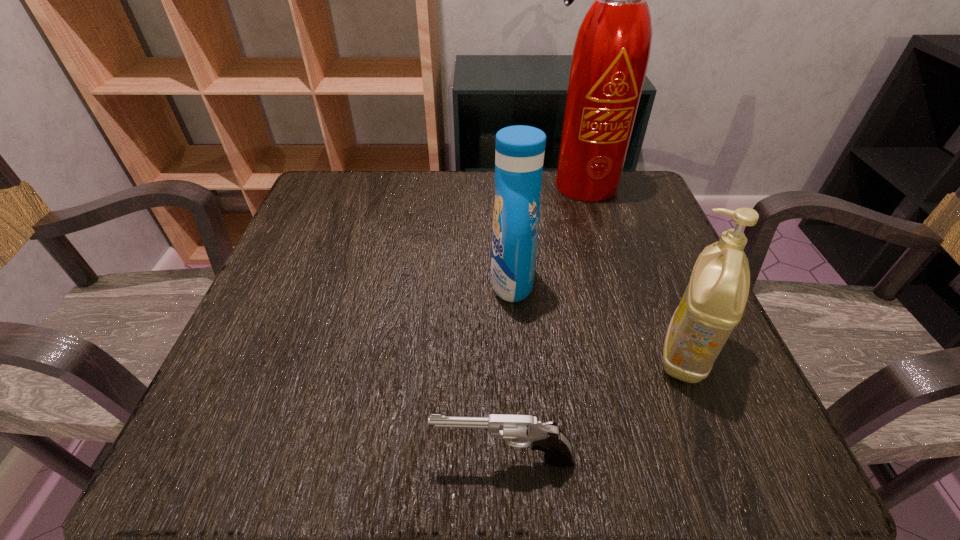
The image size is (960, 540). What are the coordinates of `object that is at the far right corner` in the screenshot? It's located at (611, 53).

What are the coordinates of `vacant space at the far edge` in the screenshot? It's located at (449, 200).

Locate an element on the screen. Image resolution: width=960 pixels, height=540 pixels. free space at the near edge of the desktop is located at coordinates pos(574,430).

Locate an element on the screen. The height and width of the screenshot is (540, 960). vacant area at the left edge of the desktop is located at coordinates (339, 275).

Locate an element on the screen. vacant region at the right edge of the desktop is located at coordinates (635, 320).

At what (x,y) coordinates should I click in order to perform the action: click on free space at the far left corner of the desktop. Please return your answer as a coordinate pair (x, y). This screenshot has width=960, height=540. Looking at the image, I should click on (329, 218).

Where is `free space at the near right corner`? This screenshot has width=960, height=540. free space at the near right corner is located at coordinates (748, 426).

This screenshot has width=960, height=540. Find the location of `free area in between the right detergent and the fire extinguisher`. free area in between the right detergent and the fire extinguisher is located at coordinates (633, 269).

The image size is (960, 540). I want to click on unoccupied area between the third farthest object and the taller detergent, so (x=598, y=317).

At what (x,y) coordinates should I click in order to perform the action: click on vacant space that is in between the farthest object and the shortest object. Please return your answer as a coordinate pair (x, y). Image resolution: width=960 pixels, height=540 pixels. Looking at the image, I should click on (542, 322).